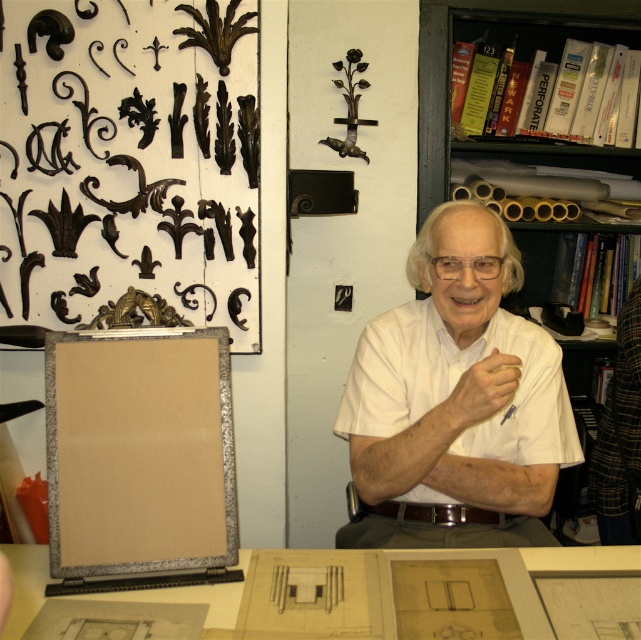
Looking at this image, based on the scene description, can you determine if the white matte shirt at center is positioned higher than the matte paper table at lower center?

Yes, the white matte shirt at center is located above the matte paper table at lower center, so it is positioned higher.

You are an interior designer assessing the space in the image. You need to determine if the white matte shirt at center can be placed on the matte paper table at lower center without overlapping the edges. Based on their widths, can the shirt fit on the table?

The white matte shirt at center is wider than the matte paper table at lower center, so it cannot fit without overlapping the edges.